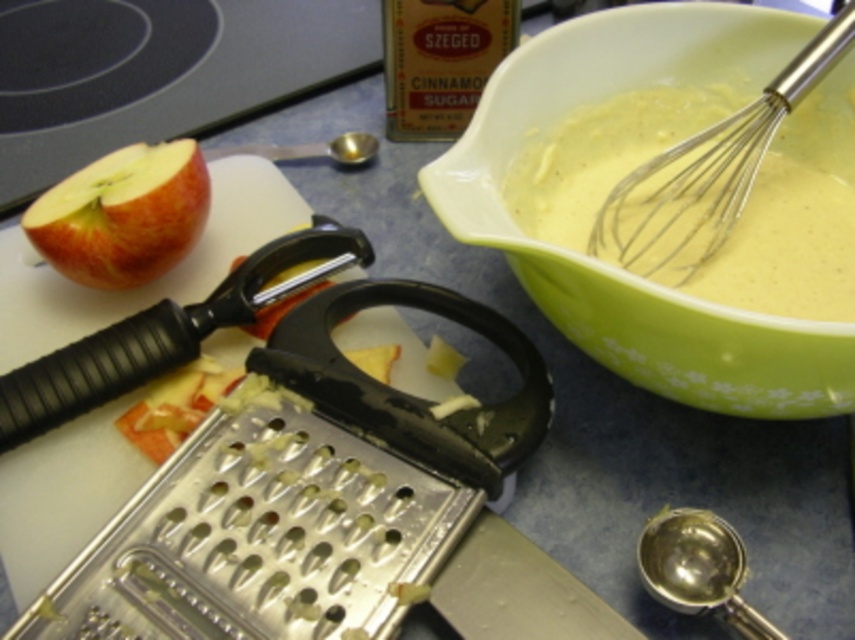
Question: Which point is closer to the camera taking this photo?

Choices:
 (A) (590, 77)
 (B) (178, 202)

Answer: (B)

Question: Which point is farther from the camera taking this photo?

Choices:
 (A) (600, 317)
 (B) (160, 173)

Answer: (B)

Question: In this image, where is metallic silver whisk at upper right located relative to red matte apple at left?

Choices:
 (A) right
 (B) left

Answer: (A)

Question: Is green matte bowl at upper right to the left of metallic silver whisk at upper right from the viewer's perspective?

Choices:
 (A) yes
 (B) no

Answer: (A)

Question: Does green matte bowl at upper right have a larger size compared to metallic silver whisk at upper right?

Choices:
 (A) yes
 (B) no

Answer: (A)

Question: Estimate the real-world distances between objects in this image. Which object is farther from the green matte bowl at upper right?

Choices:
 (A) metallic silver whisk at upper right
 (B) red matte apple at left

Answer: (B)